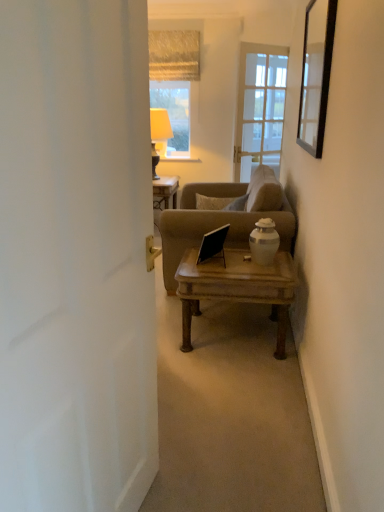
Question: From the image's perspective, does matte beige lampshade at upper center appear lower than white matte door at left?

Choices:
 (A) yes
 (B) no

Answer: (B)

Question: Can you confirm if matte beige lampshade at upper center is smaller than white matte door at left?

Choices:
 (A) no
 (B) yes

Answer: (B)

Question: From a real-world perspective, is matte beige lampshade at upper center positioned over white matte door at left based on gravity?

Choices:
 (A) yes
 (B) no

Answer: (A)

Question: From a real-world perspective, is matte beige lampshade at upper center beneath white matte door at left?

Choices:
 (A) yes
 (B) no

Answer: (B)

Question: Is matte beige lampshade at upper center shorter than white matte door at left?

Choices:
 (A) yes
 (B) no

Answer: (A)

Question: In terms of width, does white matte door at left look wider or thinner when compared to matte beige lampshade at upper center?

Choices:
 (A) wide
 (B) thin

Answer: (B)

Question: From the image's perspective, is white matte door at left above or below matte beige lampshade at upper center?

Choices:
 (A) above
 (B) below

Answer: (B)

Question: Is white matte door at left bigger or smaller than matte beige lampshade at upper center?

Choices:
 (A) small
 (B) big

Answer: (B)

Question: From a real-world perspective, is white matte door at left above or below matte beige lampshade at upper center?

Choices:
 (A) below
 (B) above

Answer: (A)

Question: From a real-world perspective, is matte beige lampshade at upper center physically located above or below wooden coffee table at center?

Choices:
 (A) above
 (B) below

Answer: (A)

Question: Which is correct: matte beige lampshade at upper center is inside wooden coffee table at center, or outside of it?

Choices:
 (A) inside
 (B) outside

Answer: (B)

Question: From the image's perspective, relative to wooden coffee table at center, is matte beige lampshade at upper center above or below?

Choices:
 (A) above
 (B) below

Answer: (A)

Question: Is point (155, 126) closer or farther from the camera than point (256, 302)?

Choices:
 (A) farther
 (B) closer

Answer: (A)

Question: Based on their positions, is white matte door at left located to the left or right of wooden coffee table at center?

Choices:
 (A) right
 (B) left

Answer: (B)

Question: Which is correct: white matte door at left is inside wooden coffee table at center, or outside of it?

Choices:
 (A) inside
 (B) outside

Answer: (B)